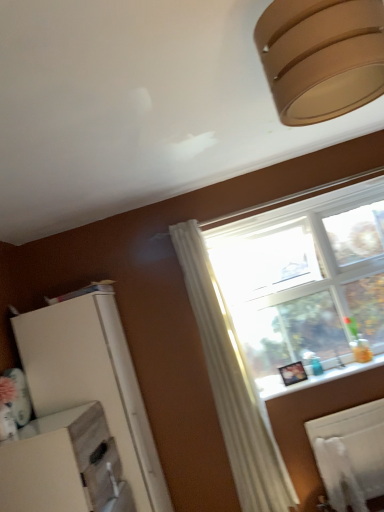
Image resolution: width=384 pixels, height=512 pixels. Describe the element at coordinates (64, 465) in the screenshot. I see `white matte dresser at lower left` at that location.

At what (x,y) coordinates should I click in order to perform the action: click on matte brown lampshade at upper right. Please return your answer as a coordinate pair (x, y). This screenshot has width=384, height=512. Looking at the image, I should click on pyautogui.click(x=321, y=56).

From the picture: Considering the relative positions of white matte radiator at lower right and white matte dresser at lower left in the image provided, is white matte radiator at lower right to the right of white matte dresser at lower left from the viewer's perspective?

Yes, white matte radiator at lower right is to the right of white matte dresser at lower left.

What's the angular difference between white matte radiator at lower right and white matte dresser at lower left's facing directions?

white matte radiator at lower right and white matte dresser at lower left are facing 89.7 degrees away from each other.

Is white matte radiator at lower right outside of white matte dresser at lower left?

white matte radiator at lower right lies outside white matte dresser at lower left's area.

Which object is positioned more to the right, matte brown lampshade at upper right or white matte dresser at lower left?

Positioned to the right is matte brown lampshade at upper right.

Is matte brown lampshade at upper right positioned with its back to white matte dresser at lower left?

No, white matte dresser at lower left is not at the back of matte brown lampshade at upper right.

Is the position of matte brown lampshade at upper right more distant than that of white matte dresser at lower left?

No, matte brown lampshade at upper right is closer to the viewer.

From the image's perspective, relative to white matte dresser at lower left, is matte brown lampshade at upper right above or below?

Based on their image positions, matte brown lampshade at upper right is located above white matte dresser at lower left.

Is white glossy window sill at lower right not close to matte brown lampshade at upper right?

Yes, white glossy window sill at lower right and matte brown lampshade at upper right are quite far apart.

Can you confirm if white glossy window sill at lower right is positioned to the left of matte brown lampshade at upper right?

No, white glossy window sill at lower right is not to the left of matte brown lampshade at upper right.

Considering the points (296, 390) and (314, 110), which point is behind, point (296, 390) or point (314, 110)?

The point (296, 390) is more distant.

Can you confirm if white glossy window sill at lower right is smaller than matte brown lampshade at upper right?

Indeed, white glossy window sill at lower right has a smaller size compared to matte brown lampshade at upper right.

Is white matte radiator at lower right bigger than matte brown lampshade at upper right?

Actually, white matte radiator at lower right might be smaller than matte brown lampshade at upper right.

Choose the correct answer: Is white matte radiator at lower right inside matte brown lampshade at upper right or outside it?

white matte radiator at lower right lies outside matte brown lampshade at upper right.

Which is in front, point (366, 446) or point (298, 20)?

The point (298, 20) is in front.

Is there a large distance between white glossy window sill at lower right and white matte dresser at lower left?

white glossy window sill at lower right is positioned a significant distance from white matte dresser at lower left.

Based on the photo, how far apart are white glossy window sill at lower right and white matte dresser at lower left?

A distance of 4.20 feet exists between white glossy window sill at lower right and white matte dresser at lower left.

Considering the sizes of objects white glossy window sill at lower right and white matte dresser at lower left in the image provided, who is smaller, white glossy window sill at lower right or white matte dresser at lower left?

Smaller between the two is white glossy window sill at lower right.

From the image's perspective, is white glossy window sill at lower right located above white matte dresser at lower left?

Yes, from the image's perspective, white glossy window sill at lower right is over white matte dresser at lower left.

Would you consider matte brown lampshade at upper right to be distant from white glossy window sill at lower right?

Yes, matte brown lampshade at upper right is far from white glossy window sill at lower right.

Consider the image. How distant is matte brown lampshade at upper right from white glossy window sill at lower right?

They are 6.85 feet apart.

Looking at this image, is the depth of matte brown lampshade at upper right less than that of white glossy window sill at lower right?

Yes.

How many degrees apart are the facing directions of matte brown lampshade at upper right and white glossy window sill at lower right?

83.8 degrees.

Is white glossy window sill at lower right a part of white matte radiator at lower right?

No, white glossy window sill at lower right is not surrounded by white matte radiator at lower right.

Considering the sizes of white matte radiator at lower right and white glossy window sill at lower right in the image, is white matte radiator at lower right taller or shorter than white glossy window sill at lower right?

white matte radiator at lower right is taller than white glossy window sill at lower right.

Is white matte radiator at lower right aimed at white glossy window sill at lower right?

Result: No, white matte radiator at lower right is not facing towards white glossy window sill at lower right.

Which is more to the left, white matte radiator at lower right or white glossy window sill at lower right?

white glossy window sill at lower right is more to the left.

You are a GUI agent. You are given a task and a screenshot of the screen. Output one action in this format:
    pyautogui.click(x=<x>, y=<y>)
    Task: Click on the radiator behind the white matte dresser at lower left
    The width and height of the screenshot is (384, 512).
    Given the screenshot: What is the action you would take?
    pyautogui.click(x=350, y=454)

Where is `dresser lying on the left of matte brown lampshade at upper right`? This screenshot has height=512, width=384. dresser lying on the left of matte brown lampshade at upper right is located at coordinates (64, 465).

Looking at the image, which one is located closer to white matte dresser at lower left, white glossy window sill at lower right or matte brown lampshade at upper right?

Among the two, white glossy window sill at lower right is located nearer to white matte dresser at lower left.

Based on their spatial positions, is white matte dresser at lower left or white glossy window sill at lower right closer to white matte radiator at lower right?

Among the two, white glossy window sill at lower right is located nearer to white matte radiator at lower right.

Looking at the image, which one is located closer to white matte radiator at lower right, white glossy window sill at lower right or matte brown lampshade at upper right?

white glossy window sill at lower right is closer to white matte radiator at lower right.

From the image, which object appears to be farther from matte brown lampshade at upper right, white matte radiator at lower right or white glossy window sill at lower right?

Based on the image, white matte radiator at lower right appears to be further to matte brown lampshade at upper right.

When comparing their distances from white glossy window sill at lower right, does matte brown lampshade at upper right or white matte radiator at lower right seem closer?

white matte radiator at lower right lies closer to white glossy window sill at lower right than the other object.

Estimate the real-world distances between objects in this image. Which object is closer to white glossy window sill at lower right, white matte dresser at lower left or white matte radiator at lower right?

white matte radiator at lower right lies closer to white glossy window sill at lower right than the other object.

Looking at the image, which one is located further to white glossy window sill at lower right, matte brown lampshade at upper right or white matte dresser at lower left?

matte brown lampshade at upper right.

Considering their positions, is matte brown lampshade at upper right positioned further to white matte radiator at lower right than white glossy window sill at lower right?

Among the two, matte brown lampshade at upper right is located further to white matte radiator at lower right.

You are a GUI agent. You are given a task and a screenshot of the screen. Output one action in this format:
    pyautogui.click(x=<x>, y=<y>)
    Task: Click on the dresser between matte brown lampshade at upper right and white matte radiator at lower right in the vertical direction
    The image size is (384, 512).
    Given the screenshot: What is the action you would take?
    pyautogui.click(x=64, y=465)

This screenshot has height=512, width=384. I want to click on dresser between matte brown lampshade at upper right and white glossy window sill at lower right in the front-back direction, so click(x=64, y=465).

Where is `radiator positioned between matte brown lampshade at upper right and white glossy window sill at lower right from near to far`? This screenshot has width=384, height=512. radiator positioned between matte brown lampshade at upper right and white glossy window sill at lower right from near to far is located at coordinates (x=350, y=454).

Find the location of a particular element. This screenshot has height=512, width=384. window sill between white matte dresser at lower left and white matte radiator at lower right in the horizontal direction is located at coordinates [313, 378].